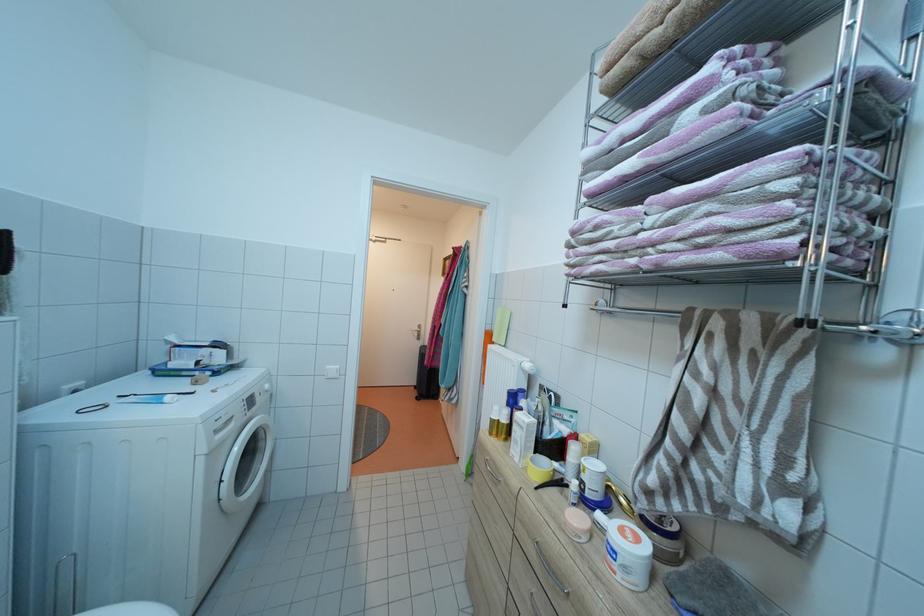
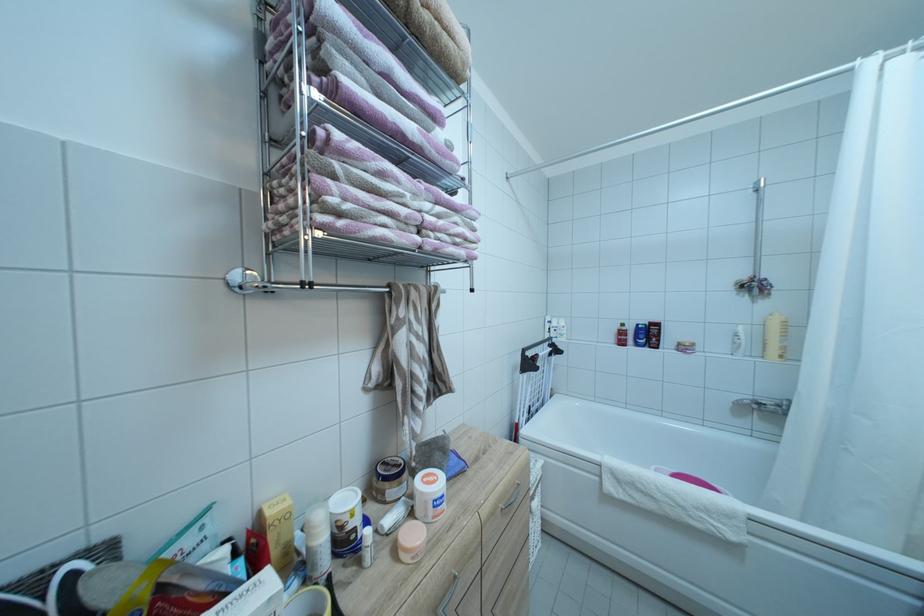
Find the pixel in the second image that matches [633,543] in the first image.

(442, 487)